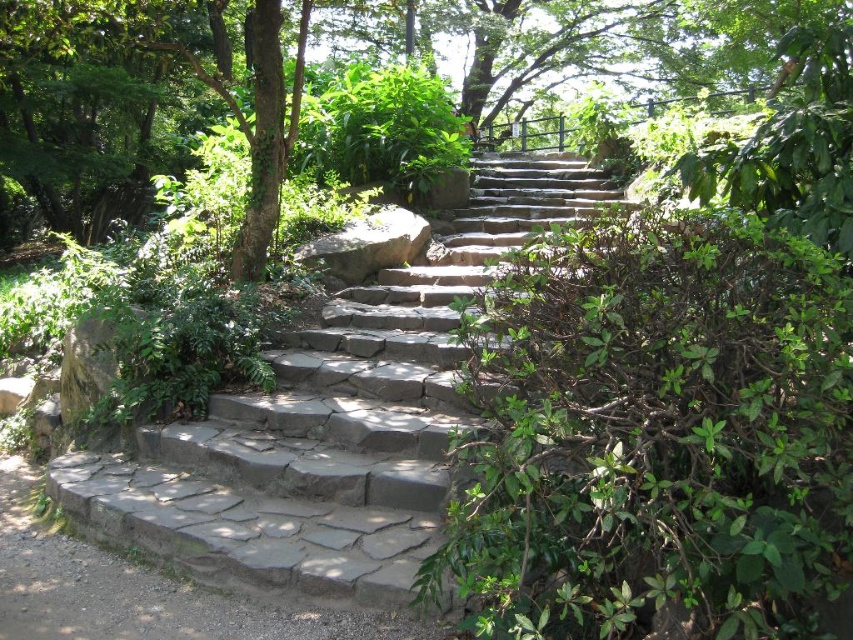
Question: Is gray stone stairs at center to the right of gray stone steps at lower left from the viewer's perspective?

Choices:
 (A) yes
 (B) no

Answer: (A)

Question: Estimate the real-world distances between objects in this image. Which object is farther from the gray stone stairs at center?

Choices:
 (A) gray stone steps at lower left
 (B) gray rough rock at center

Answer: (A)

Question: Can you confirm if gray stone steps at lower left is wider than gray rough rock at center?

Choices:
 (A) yes
 (B) no

Answer: (A)

Question: Which of these objects is positioned closest to the gray stone steps at lower left?

Choices:
 (A) gray rough rock at center
 (B) gray stone stairs at center

Answer: (A)

Question: Which object is positioned farthest from the gray stone steps at lower left?

Choices:
 (A) gray stone stairs at center
 (B) gray rough rock at center

Answer: (A)

Question: Is gray stone stairs at center wider than gray rough rock at center?

Choices:
 (A) yes
 (B) no

Answer: (B)